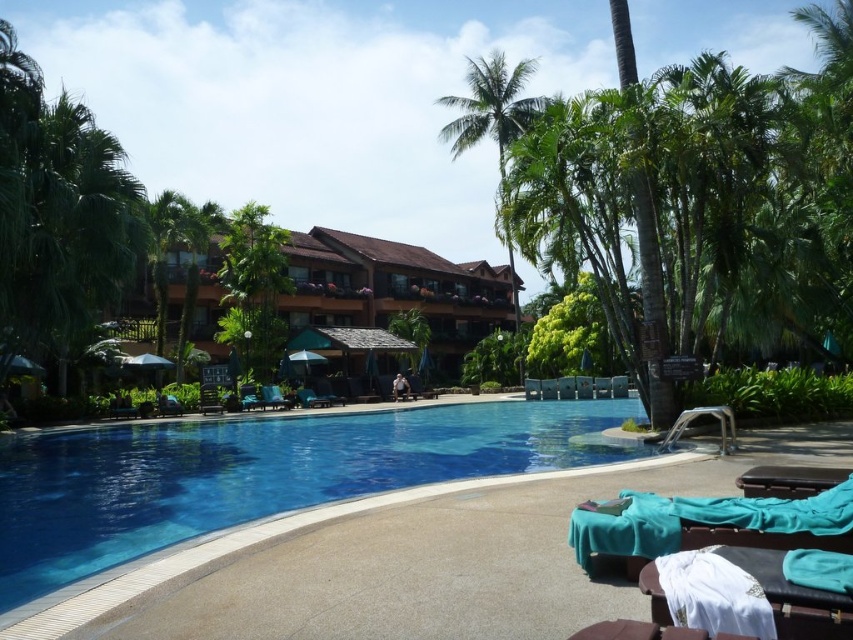
Does blue glossy water at center appear over matte black lounge chair at lower left?

Correct, blue glossy water at center is located above matte black lounge chair at lower left.

Measure the distance between blue glossy water at center and matte black lounge chair at lower left.

The distance of blue glossy water at center from matte black lounge chair at lower left is 7.76 meters.

Find the location of a particular element. blue glossy water at center is located at coordinates (256, 474).

Between green leafy palm tree at upper left and metallic silver beach chair at lower right, which one appears on the left side from the viewer's perspective?

green leafy palm tree at upper left is more to the left.

Does green leafy palm tree at upper left appear under metallic silver beach chair at lower right?

Actually, green leafy palm tree at upper left is above metallic silver beach chair at lower right.

Image resolution: width=853 pixels, height=640 pixels. What do you see at coordinates (254, 285) in the screenshot? I see `green leafy palm tree at upper left` at bounding box center [254, 285].

You are a GUI agent. You are given a task and a screenshot of the screen. Output one action in this format:
    pyautogui.click(x=<x>, y=<y>)
    Task: Click on the green leafy palm tree at upper left
    This screenshot has width=853, height=640.
    Given the screenshot: What is the action you would take?
    pyautogui.click(x=254, y=285)

Between brown wooden hotel at center and green leafy palm tree at upper left, which one has more height?

brown wooden hotel at center is taller.

Between point (352, 291) and point (234, 314), which one is positioned in front?

Point (234, 314)

I want to click on brown wooden hotel at center, so click(393, 291).